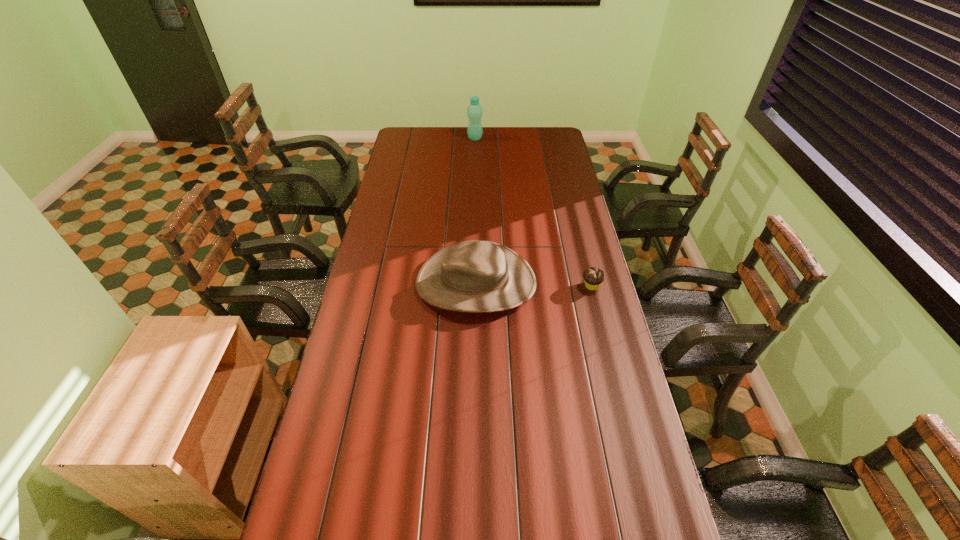
Locate an element on the screen. vacant region at the far edge is located at coordinates (484, 138).

In the image, there is a desktop. Where is `vacant space at the left edge`? The height and width of the screenshot is (540, 960). vacant space at the left edge is located at coordinates (361, 427).

In order to click on vacant space at the right edge in this screenshot , I will do `click(551, 150)`.

This screenshot has width=960, height=540. I want to click on free spot between the rightmost object and the farthest object, so click(534, 212).

Identify the location of unoccupied position between the bottle and the second tallest object. (475, 210).

Image resolution: width=960 pixels, height=540 pixels. I want to click on unoccupied position between the farthest object and the rightmost object, so click(x=534, y=212).

Identify which object is located as the nearest to the shortest object. Please provide its 2D coordinates. Your answer should be formatted as a tuple, i.e. [(x, y)], where the tuple contains the x and y coordinates of a point satisfying the conditions above.

[(476, 276)]

Identify which object is the second closest to the second tallest object. Please provide its 2D coordinates. Your answer should be formatted as a tuple, i.e. [(x, y)], where the tuple contains the x and y coordinates of a point satisfying the conditions above.

[(474, 111)]

This screenshot has width=960, height=540. I want to click on free space that satisfies the following two spatial constraints: 1. on the front side of the bottle; 2. on the right side of the cowboy hat, so click(x=472, y=282).

Identify the location of free point that satisfies the following two spatial constraints: 1. on the front side of the bottle; 2. on the right side of the second shortest object. The image size is (960, 540). coord(472,282).